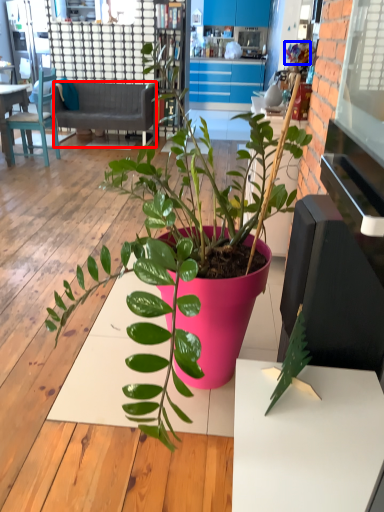
Question: Which object appears closest to the camera in this image, studio couch (highlighted by a red box) or flower (highlighted by a blue box)?

Choices:
 (A) studio couch
 (B) flower

Answer: (A)